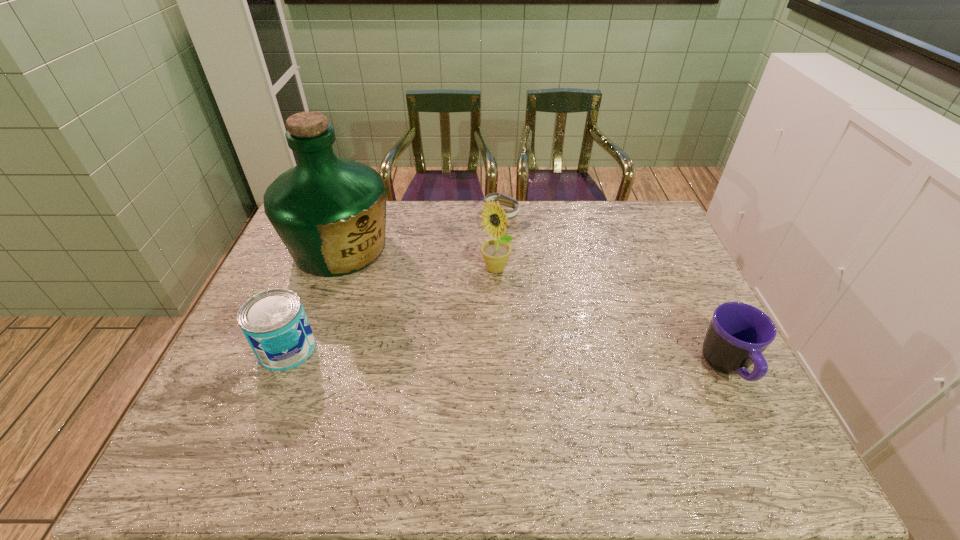
Identify the location of free space located on the face of the watch. (517, 250).

Where is `vacant space situated on the face of the watch`? Image resolution: width=960 pixels, height=540 pixels. vacant space situated on the face of the watch is located at coordinates (529, 276).

Locate an element on the screen. The height and width of the screenshot is (540, 960). vacant space located 0.180m on the face of the watch is located at coordinates (520, 258).

Locate an element on the screen. This screenshot has width=960, height=540. free space located on the label side of the liquor is located at coordinates (x=436, y=333).

At what (x,y) coordinates should I click in order to perform the action: click on vacant space located 0.350m on the label side of the liquor. Please return your answer as a coordinate pair (x, y). Image resolution: width=960 pixels, height=540 pixels. Looking at the image, I should click on (443, 339).

What are the coordinates of `vacant region located on the label side of the liquor` in the screenshot? It's located at (420, 319).

Identify the location of watch that is at the far edge. The width and height of the screenshot is (960, 540). (505, 200).

The image size is (960, 540). I want to click on liquor that is at the far edge, so click(x=330, y=213).

Where is `object present at the near edge`? object present at the near edge is located at coordinates pos(738,334).

Where is `can at the left edge`? The width and height of the screenshot is (960, 540). can at the left edge is located at coordinates (274, 322).